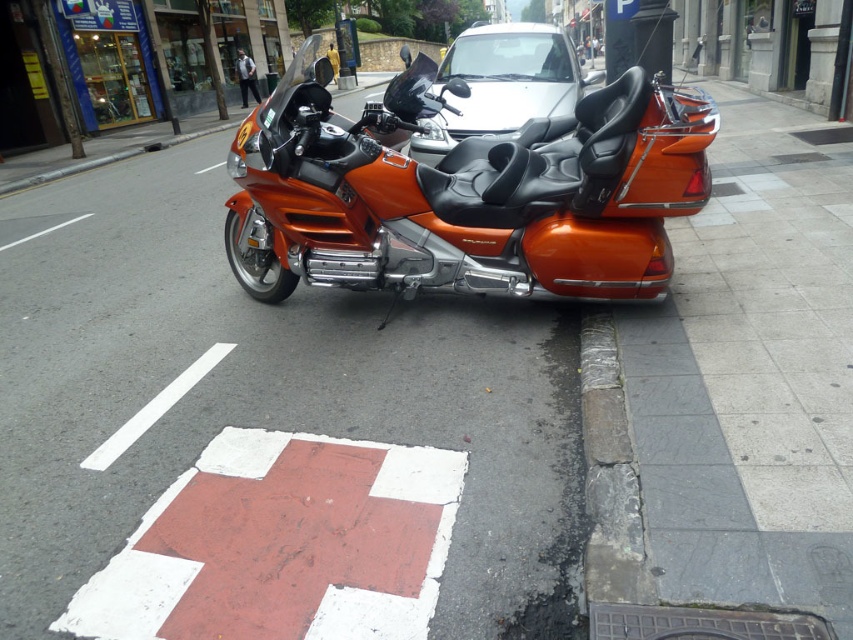
You are standing at the origin point of the coordinate system. You want to walk towards the orange metallic motorcycle at center. What direction should you walk in?

Since the orange metallic motorcycle at center is located at coordinate point (463, 192), you should walk northeast to reach it.

From the picture: You are standing at the point marked by the coordinates (463, 192) on the road. Based on the scene description, what object is located exactly at that point?

The point at coordinates (463, 192) corresponds to the orange metallic motorcycle at center.